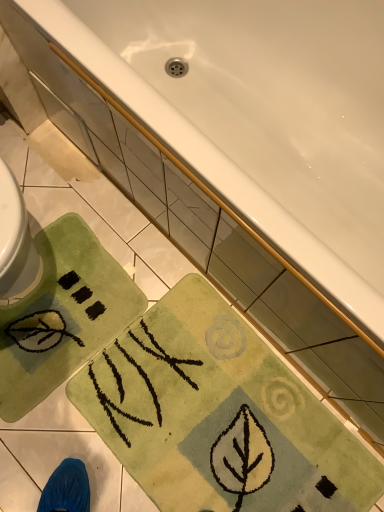
Question: Does green soft rug at lower left, the 2th beach towel from the right, lie in front of green soft rug at lower center, the 1th beach towel viewed from the right?

Choices:
 (A) yes
 (B) no

Answer: (B)

Question: Can you confirm if green soft rug at lower left, positioned as the 1th beach towel in left-to-right order, is bigger than green soft rug at lower center, placed as the 2th beach towel when sorted from left to right?

Choices:
 (A) no
 (B) yes

Answer: (A)

Question: Considering the relative sizes of green soft rug at lower left, the 2th beach towel from the right, and green soft rug at lower center, the 1th beach towel viewed from the right, in the image provided, is green soft rug at lower left, the 2th beach towel from the right, taller than green soft rug at lower center, the 1th beach towel viewed from the right,?

Choices:
 (A) no
 (B) yes

Answer: (B)

Question: Considering the relative sizes of green soft rug at lower left, the 2th beach towel from the right, and green soft rug at lower center, the 1th beach towel viewed from the right, in the image provided, is green soft rug at lower left, the 2th beach towel from the right, smaller than green soft rug at lower center, the 1th beach towel viewed from the right,?

Choices:
 (A) no
 (B) yes

Answer: (B)

Question: Can you confirm if green soft rug at lower left, positioned as the 1th beach towel in left-to-right order, is wider than green soft rug at lower center, placed as the 2th beach towel when sorted from left to right?

Choices:
 (A) yes
 (B) no

Answer: (B)

Question: Considering the relative sizes of green soft rug at lower left, the 2th beach towel from the right, and green soft rug at lower center, placed as the 2th beach towel when sorted from left to right, in the image provided, is green soft rug at lower left, the 2th beach towel from the right, thinner than green soft rug at lower center, placed as the 2th beach towel when sorted from left to right,?

Choices:
 (A) no
 (B) yes

Answer: (B)

Question: Is white glossy bathtub at upper center behind green soft rug at lower center, the 1th beach towel viewed from the right?

Choices:
 (A) no
 (B) yes

Answer: (A)

Question: Is white glossy bathtub at upper center not near green soft rug at lower center, placed as the 2th beach towel when sorted from left to right?

Choices:
 (A) no
 (B) yes

Answer: (A)

Question: Is white glossy bathtub at upper center to the left of green soft rug at lower center, placed as the 2th beach towel when sorted from left to right, from the viewer's perspective?

Choices:
 (A) no
 (B) yes

Answer: (A)

Question: Does white glossy bathtub at upper center have a larger size compared to green soft rug at lower center, placed as the 2th beach towel when sorted from left to right?

Choices:
 (A) no
 (B) yes

Answer: (B)

Question: Does white glossy bathtub at upper center appear on the right side of green soft rug at lower center, placed as the 2th beach towel when sorted from left to right?

Choices:
 (A) yes
 (B) no

Answer: (A)

Question: Can you confirm if white glossy bathtub at upper center is thinner than green soft rug at lower center, placed as the 2th beach towel when sorted from left to right?

Choices:
 (A) no
 (B) yes

Answer: (A)

Question: From a real-world perspective, is white glossy bathtub at upper center on green soft rug at lower left, the 2th beach towel from the right?

Choices:
 (A) yes
 (B) no

Answer: (A)